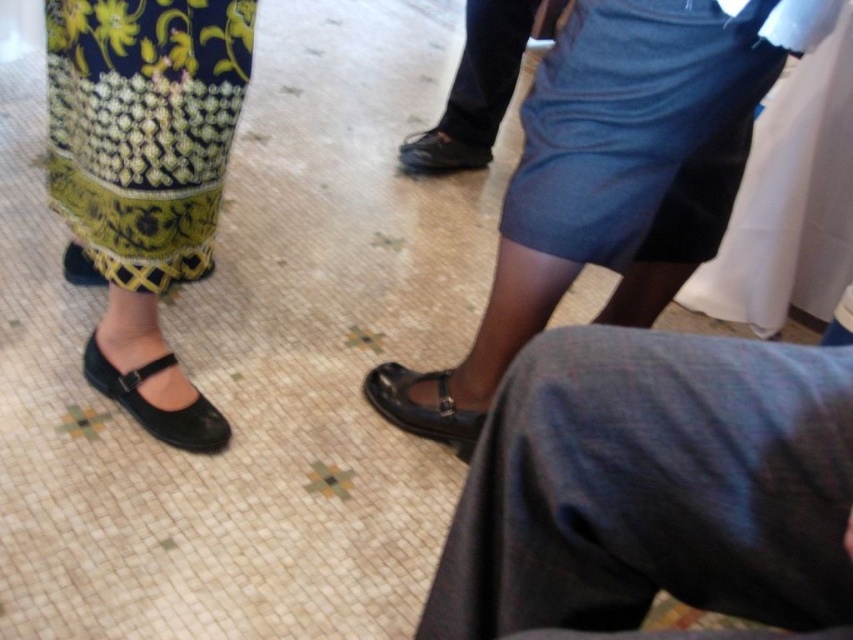
Question: Can you confirm if blue denim skirt at upper center is bigger than black leather shoe at center?

Choices:
 (A) no
 (B) yes

Answer: (B)

Question: Considering the real-world distances, which object is farthest from the black leather shoe at center?

Choices:
 (A) blue denim skirt at upper center
 (B) black leather sandal at lower left
 (C) dark blue fabric pants at lower right
 (D) matte black shoes at center

Answer: (C)

Question: Which object is farther from the camera taking this photo?

Choices:
 (A) dark blue fabric pants at lower right
 (B) blue denim skirt at upper center
 (C) black leather sandal at lower left

Answer: (C)

Question: Is blue denim skirt at upper center positioned at the back of black leather sandal at lower left?

Choices:
 (A) no
 (B) yes

Answer: (A)

Question: Is blue denim skirt at upper center further to camera compared to black leather shoe at center?

Choices:
 (A) yes
 (B) no

Answer: (B)

Question: Which point is closer to the camera taking this photo?

Choices:
 (A) 90,349
 (B) 119,220
 (C) 519,426

Answer: (C)